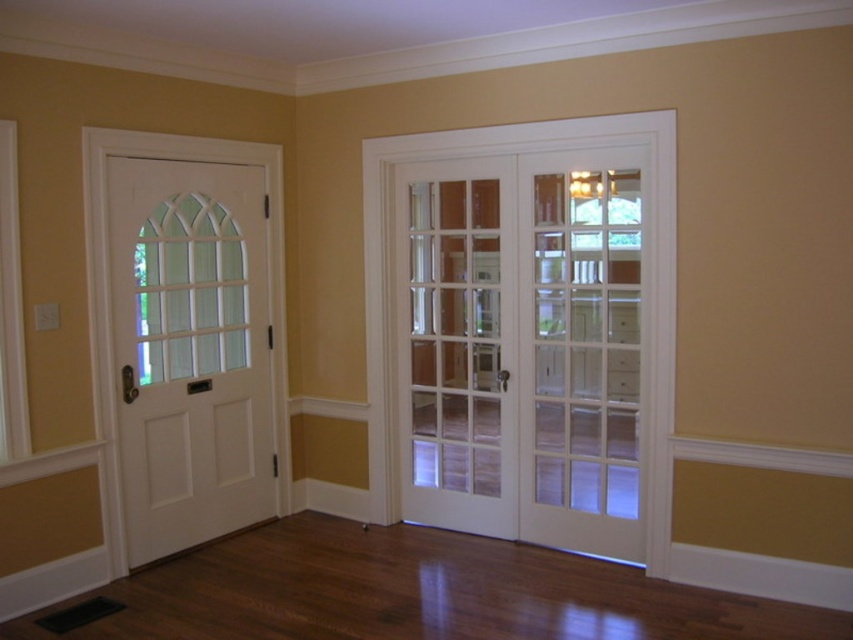
Who is more forward, (x=412, y=355) or (x=161, y=531)?

Point (x=161, y=531) is more forward.

Is point (442, 291) less distant than point (184, 243)?

No, it is not.

Locate an element on the screen. clear glass doors at center is located at coordinates [x=523, y=348].

Does white glossy door at left have a greater width compared to clear glass door at center?

Correct, the width of white glossy door at left exceeds that of clear glass door at center.

Does white glossy door at left lie behind clear glass door at center?

Yes.

This screenshot has width=853, height=640. In order to click on white glossy door at left in this screenshot , I will do `click(190, 349)`.

Does clear glass doors at center lie behind clear glass door at center?

That is False.

Does clear glass doors at center appear on the right side of clear glass door at center?

Incorrect, clear glass doors at center is not on the right side of clear glass door at center.

Does point (585, 333) come closer to viewer compared to point (538, 513)?

Yes.

In order to click on clear glass doors at center in this screenshot , I will do `click(523, 348)`.